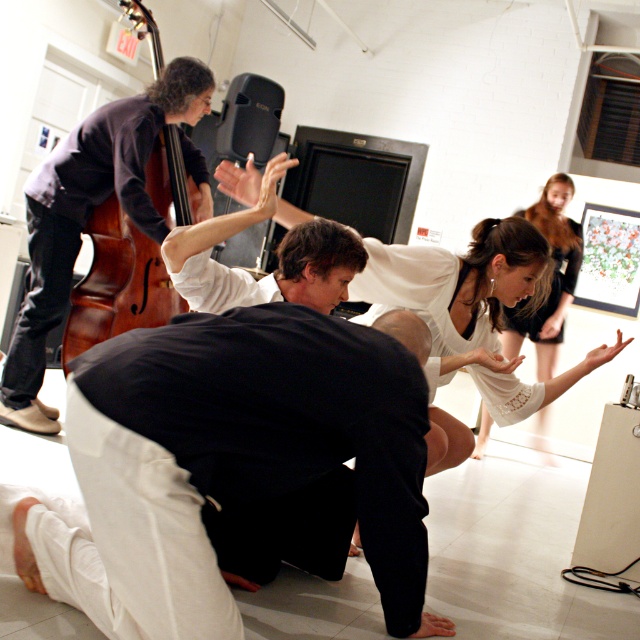
Question: Which object appears closest to the camera in this image?

Choices:
 (A) white lace dress at center
 (B) white lace dress at upper right

Answer: (A)

Question: Does brown wooden cello at left have a greater width compared to white lace dress at upper right?

Choices:
 (A) no
 (B) yes

Answer: (A)

Question: Which object appears farthest from the camera in this image?

Choices:
 (A) white lace dress at upper right
 (B) white lace dress at center
 (C) brown wooden cello at left
 (D) black matte pants at lower center

Answer: (A)

Question: Among these objects, which one is farthest from the camera?

Choices:
 (A) white lace dress at center
 (B) brown wooden cello at left
 (C) black matte pants at lower center
 (D) white lace dress at upper right

Answer: (D)

Question: Can you confirm if white lace dress at center is wider than brown wooden cello at left?

Choices:
 (A) no
 (B) yes

Answer: (B)

Question: Does brown wooden cello at left have a lesser width compared to white lace dress at upper right?

Choices:
 (A) no
 (B) yes

Answer: (B)